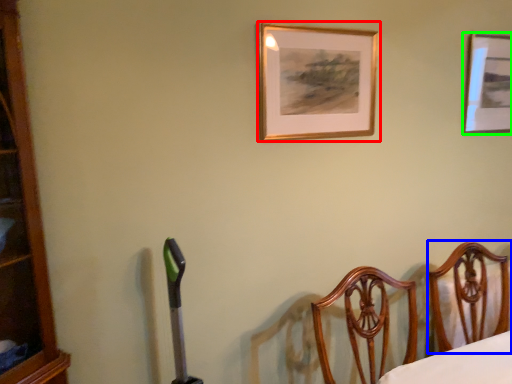
Question: Based on their relative distances, which object is nearer to picture frame (highlighted by a red box)? Choose from furniture (highlighted by a blue box) and picture frame (highlighted by a green box).

Choices:
 (A) furniture
 (B) picture frame

Answer: (B)